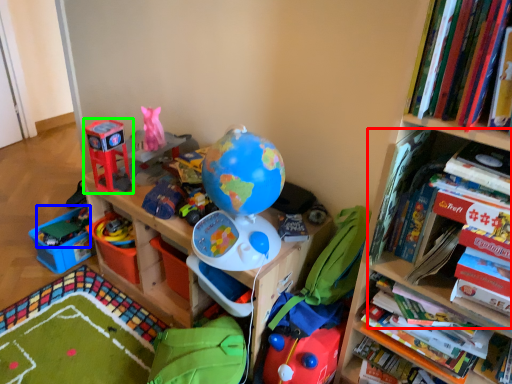
Question: Considering the real-world distances, which object is farthest from book (highlighted by a red box)? toy (highlighted by a blue box) or toy (highlighted by a green box)?

Choices:
 (A) toy
 (B) toy

Answer: (A)